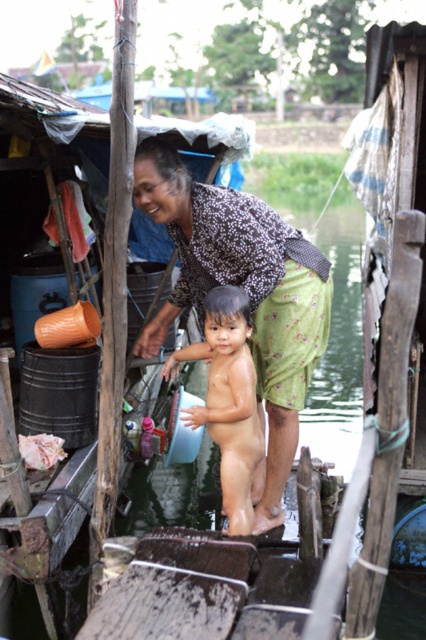
You are a photographer trying to capture both the printed fabric shirt at center and the smooth skin baby at center in a single frame. Given that your camera has a limited focus range, which object should you prioritize focusing on to ensure it appears sharp, considering their sizes?

The printed fabric shirt at center is larger than the smooth skin baby at center, so focusing on the printed fabric shirt at center would ensure it appears sharp within the camera focus range.

You are a photographer taking a picture of the printed fabric shirt at center and the smooth skin baby at center. Which object should you focus on first if you want to capture both clearly in the frame?

The printed fabric shirt at center is larger in size than the smooth skin baby at center, so you should focus on the printed fabric shirt at center first to ensure both are in focus.

You are a photographer trying to capture the scene of the child and the woman. The printed fabric shirt at center is part of the woman. To ensure the woman is in focus, where should you position the camera relative to the child?

The printed fabric shirt at center is located at point (247,291), so you should position the camera so that the woman is in focus by focusing on the printed fabric shirt at center which is part of her clothing.